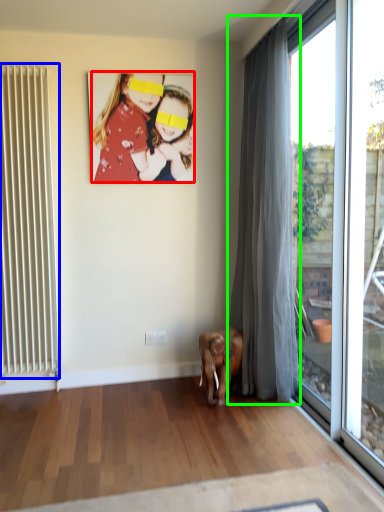
Question: Which is nearer to the person (highlighted by a red box)? radiator (highlighted by a blue box) or curtain (highlighted by a green box).

Choices:
 (A) radiator
 (B) curtain

Answer: (A)